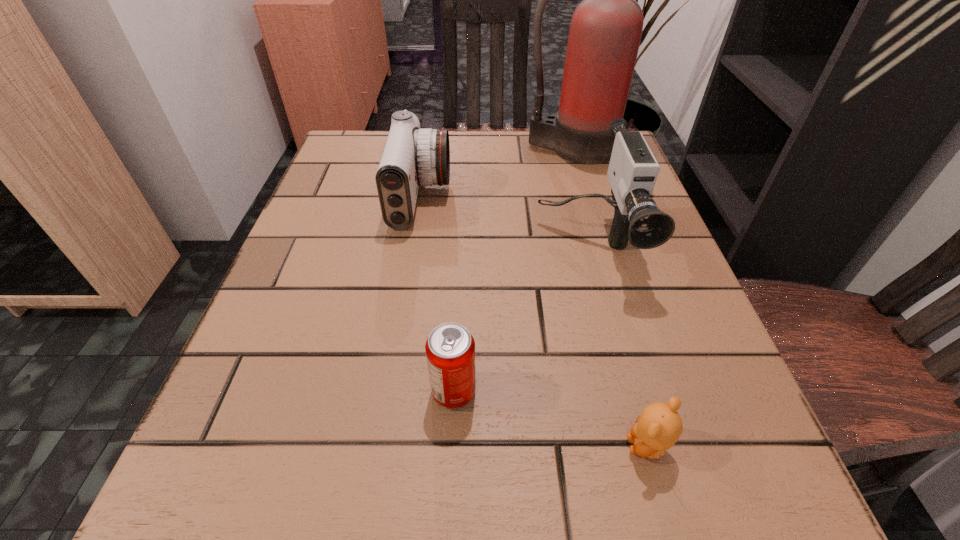
You are a GUI agent. You are given a task and a screenshot of the screen. Output one action in this format:
    pyautogui.click(x=<x>, y=<y>)
    Task: Click on the farthest object
    The height and width of the screenshot is (540, 960).
    Given the screenshot: What is the action you would take?
    pyautogui.click(x=605, y=32)

Where is `the tallest object`? the tallest object is located at coordinates (605, 32).

Locate an element on the screen. The height and width of the screenshot is (540, 960). the right camcorder is located at coordinates (633, 170).

What are the coordinates of `the taller camcorder` in the screenshot? It's located at pyautogui.click(x=633, y=170).

This screenshot has height=540, width=960. In order to click on the shorter camcorder in this screenshot , I will do `click(412, 156)`.

At what (x,y) coordinates should I click in order to perform the action: click on the third tallest object. Please return your answer as a coordinate pair (x, y). Looking at the image, I should click on (412, 156).

Find the location of `the second nearest object`. the second nearest object is located at coordinates (450, 348).

You are a GUI agent. You are given a task and a screenshot of the screen. Output one action in this format:
    pyautogui.click(x=<x>, y=<y>)
    Task: Click on the fourth tallest object
    This screenshot has height=540, width=960.
    Given the screenshot: What is the action you would take?
    pyautogui.click(x=450, y=348)

Image resolution: width=960 pixels, height=540 pixels. Find the location of `the shortest object`. the shortest object is located at coordinates (657, 429).

Where is `the nearest object`? the nearest object is located at coordinates (657, 429).